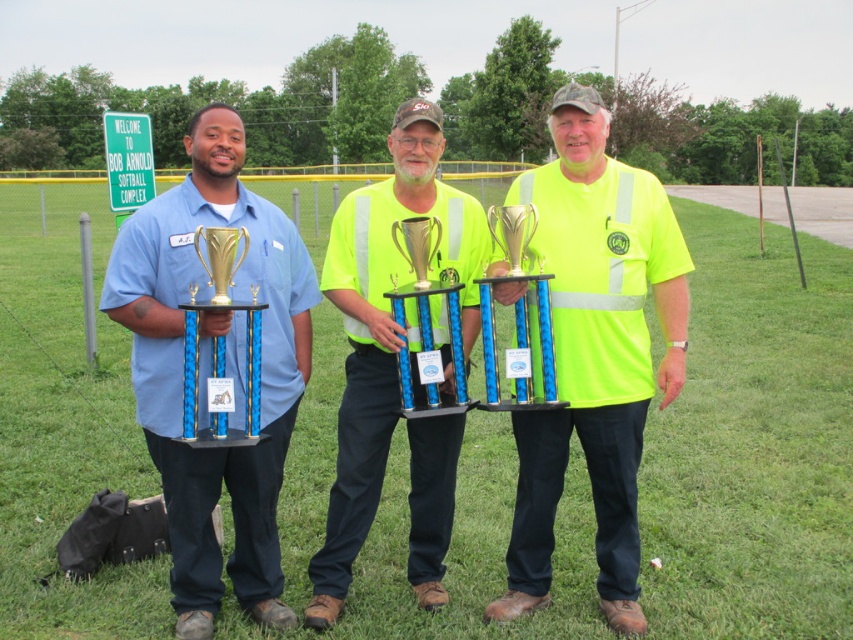
Based on the coordinates provided in the scene description, where is the neon yellow reflective safety vest at center located?

The neon yellow reflective safety vest at center is located at the coordinates point (601, 275).